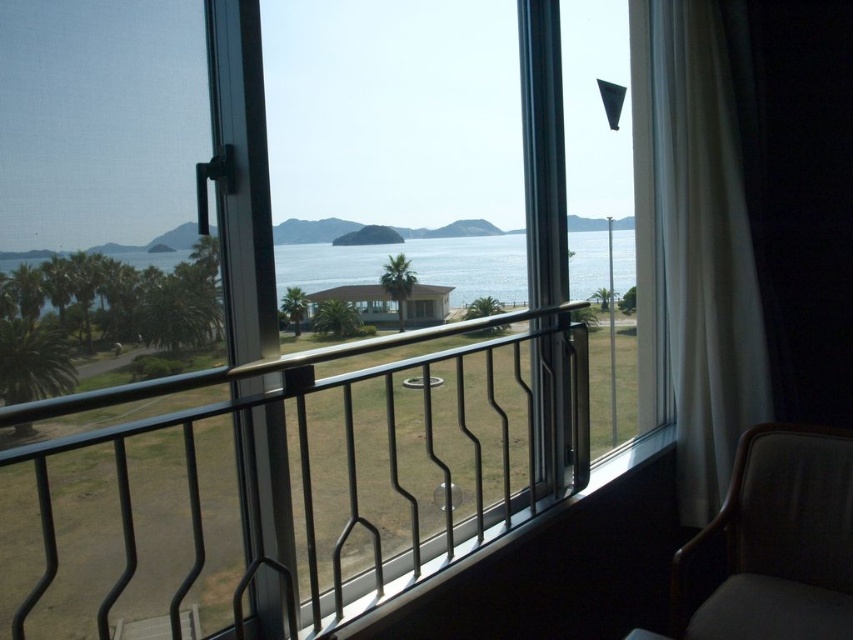
You are standing in the room and want to open the white sheer curtain at right to let more light in. If you are currently 7.48 feet away from the curtain, can you reach it without moving closer?

The white sheer curtain at right is 7.48 feet away from the viewer. Since the average person can typically reach about 2.5 to 3 feet in front of themselves, you would need to move closer to reach the curtain.

You are standing inside the room and want to exit to the balcony. The clear glass screen door at left is located at coordinates 0.339, 0.169. If you move straight towards the door, will you collide with any objects in the room?

The clear glass screen door at left is located at coordinates (143, 216). Since the scene description does not mention any objects blocking the path to the door, you can move straight towards it without colliding with any objects.